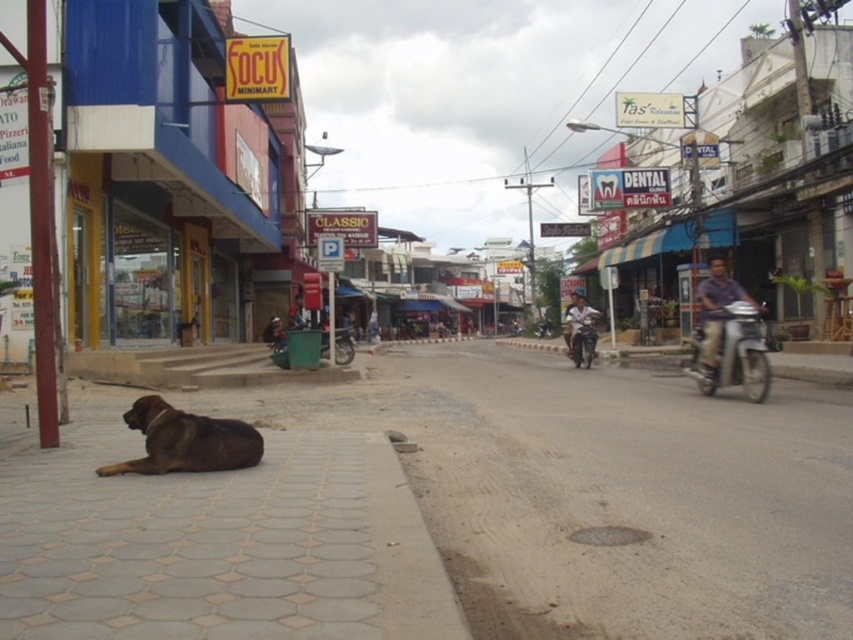
Question: Does metallic silver scooter at right have a larger size compared to metallic silver scooter at center-right?

Choices:
 (A) yes
 (B) no

Answer: (A)

Question: Which of these objects is positioned farthest from the brown furry dog at lower left?

Choices:
 (A) brown stone pavement at lower left
 (B) metallic silver scooter at center-right
 (C) metallic silver scooter at right

Answer: (B)

Question: Is brown paving stone at lower left positioned at the back of brown stone pavement at lower left?

Choices:
 (A) yes
 (B) no

Answer: (B)

Question: Among these points, which one is nearest to the camera?

Choices:
 (A) (256, 449)
 (B) (691, 339)
 (C) (585, 348)

Answer: (A)

Question: Which point is farther to the camera?

Choices:
 (A) (253, 440)
 (B) (578, 320)

Answer: (B)

Question: Does brown paving stone at lower left have a smaller size compared to metallic silver scooter at right?

Choices:
 (A) yes
 (B) no

Answer: (B)